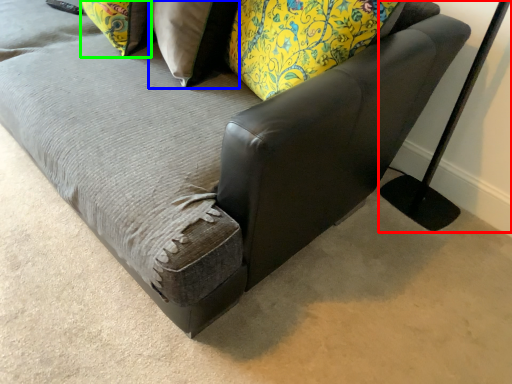
Question: Based on their relative distances, which object is farther from table lamp (highlighted by a red box)? Choose from pillow (highlighted by a blue box) and pillow (highlighted by a green box).

Choices:
 (A) pillow
 (B) pillow

Answer: (B)